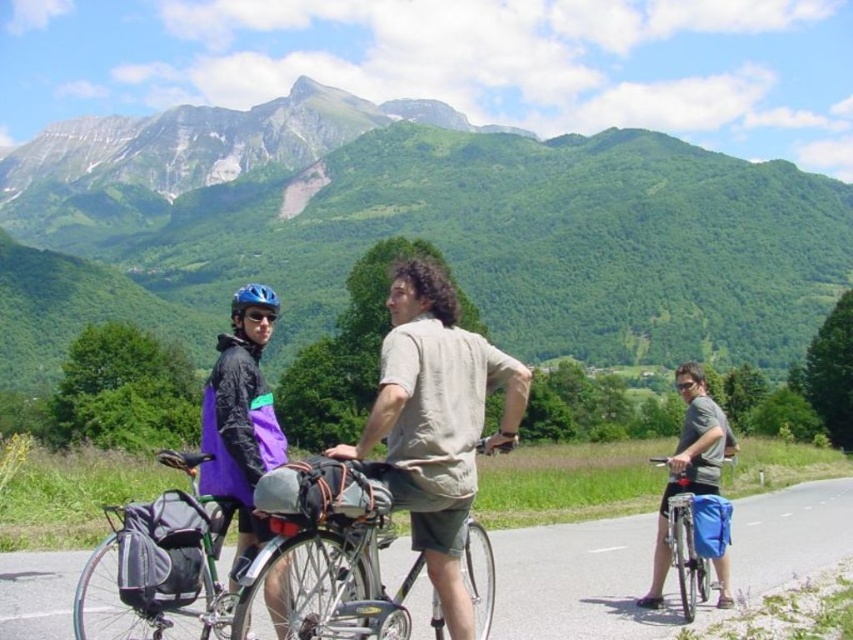
Question: Can you confirm if green grassy mountain at upper center is thinner than metallic bicycle at center?

Choices:
 (A) no
 (B) yes

Answer: (A)

Question: Among these objects, which one is nearest to the camera?

Choices:
 (A) matte black jacket at left
 (B) blue matte bicycle helmet at upper left
 (C) blue fabric bag at right
 (D) silver metallic bicycle at center

Answer: (D)

Question: Can you confirm if green grassy mountain at upper center is positioned to the left of silver metallic bicycle at center?

Choices:
 (A) yes
 (B) no

Answer: (A)

Question: Which object is farther from the camera taking this photo?

Choices:
 (A) blue fabric bag at right
 (B) blue matte bicycle helmet at upper left
 (C) matte black jacket at left

Answer: (B)

Question: Considering the real-world distances, which object is farthest from the matte black jacket at left?

Choices:
 (A) metallic bicycle at center
 (B) blue matte bicycle helmet at upper left
 (C) blue fabric bag at right

Answer: (B)

Question: Is metallic bicycle at center bigger than silver metallic bicycle at center?

Choices:
 (A) yes
 (B) no

Answer: (A)